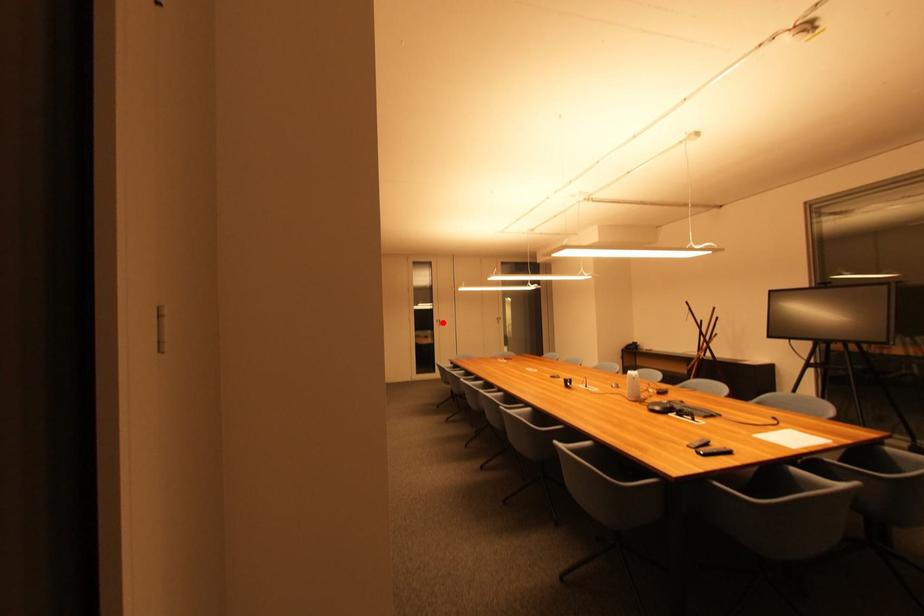
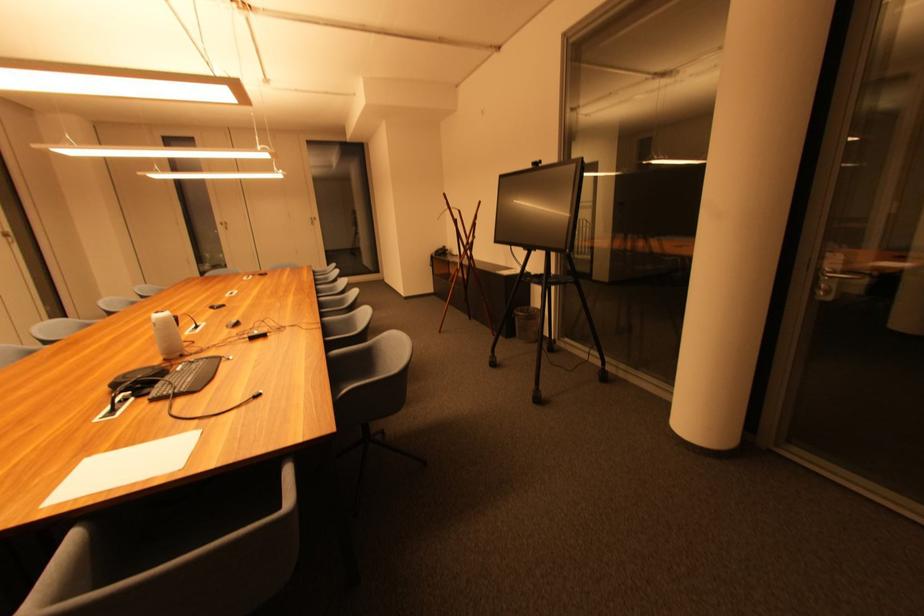
Find the pixel in the second image that matches the highlighted location in the first image.

(226, 225)